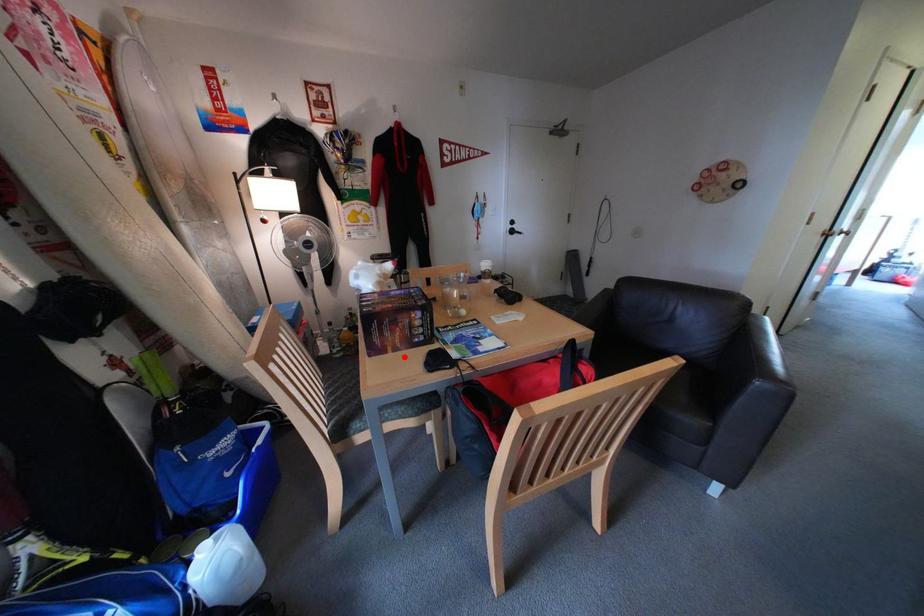
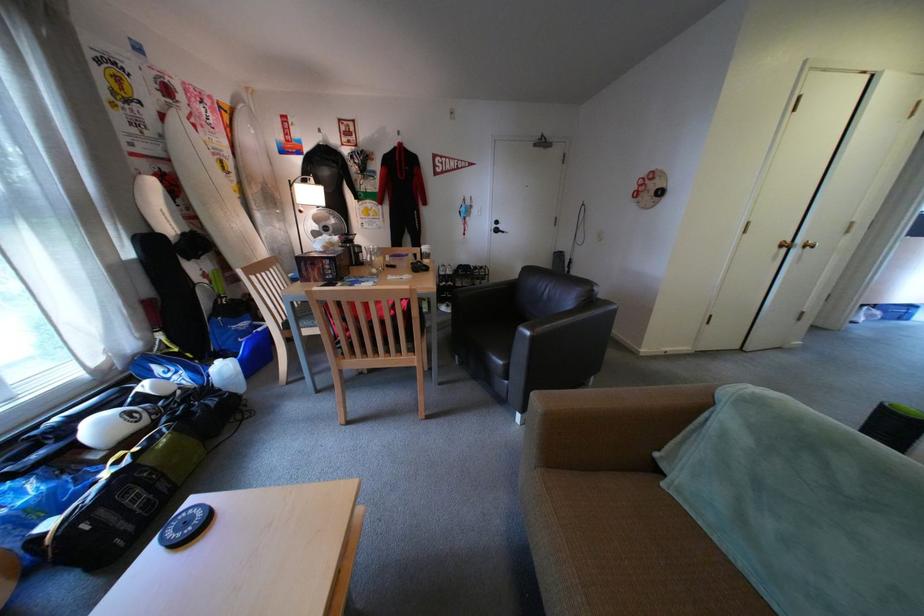
Locate, in the second image, the point that corresponds to the highlighted location in the first image.

(325, 285)